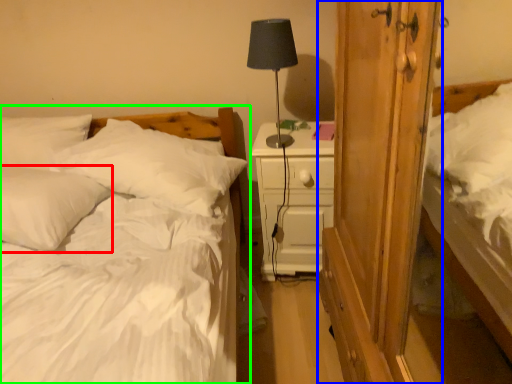
Question: Which object is positioned farthest from pillow (highlighted by a red box)? Select from armoire (highlighted by a blue box) and bed (highlighted by a green box).

Choices:
 (A) armoire
 (B) bed

Answer: (A)